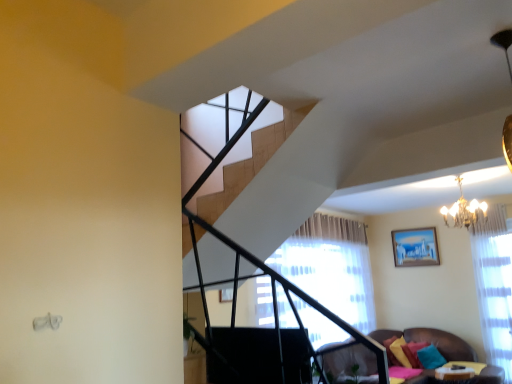
Question: Is point (407, 264) closer or farther from the camera than point (335, 367)?

Choices:
 (A) farther
 (B) closer

Answer: (A)

Question: Looking at their shapes, would you say matte blue painting at upper right is wider or thinner than velvet brown couch at lower right?

Choices:
 (A) thin
 (B) wide

Answer: (A)

Question: Considering the real-world distances, which object is farthest from the velvet brown couch at lower right?

Choices:
 (A) teal fabric pillow at lower right, which appears as the second pillow when viewed from the left
 (B) gold crystal chandelier at upper right
 (C) wooden table at lower right
 (D) matte blue painting at upper right
 (E) teal fabric pillow at lower right, which is counted as the third pillow, starting from the left

Answer: (D)

Question: Which is nearer to the matte blue painting at upper right?

Choices:
 (A) velvet brown couch at lower right
 (B) gold crystal chandelier at upper right
 (C) wooden table at lower right
 (D) teal fabric pillow at lower right, which appears as the second pillow when viewed from the left
 (E) velvet yellow pillow at lower right, acting as the first pillow starting from the left

Answer: (B)